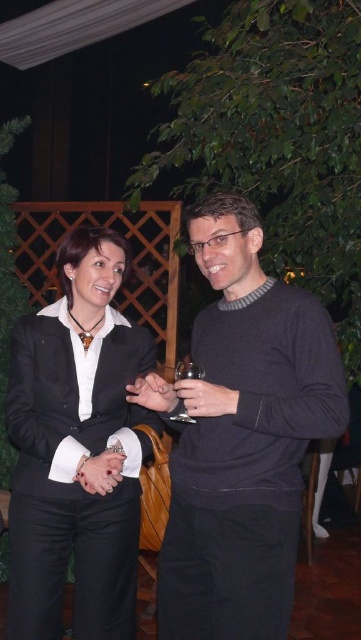
Question: Which point is closer to the camera?

Choices:
 (A) dark gray sweater at center
 (B) transparent glass at center

Answer: (A)

Question: Can you confirm if dark gray sweater at center is thinner than transparent glass at center?

Choices:
 (A) no
 (B) yes

Answer: (A)

Question: Which point appears farthest from the camera in this image?

Choices:
 (A) (177, 364)
 (B) (63, 252)
 (C) (181, 580)

Answer: (A)

Question: Is matte black suit at center wider than transparent glass at center?

Choices:
 (A) no
 (B) yes

Answer: (B)

Question: Which of these objects is positioned closest to the transparent glass at center?

Choices:
 (A) matte black suit at center
 (B) dark gray sweater at center

Answer: (B)

Question: Is dark gray sweater at center to the left of transparent glass at center from the viewer's perspective?

Choices:
 (A) yes
 (B) no

Answer: (B)